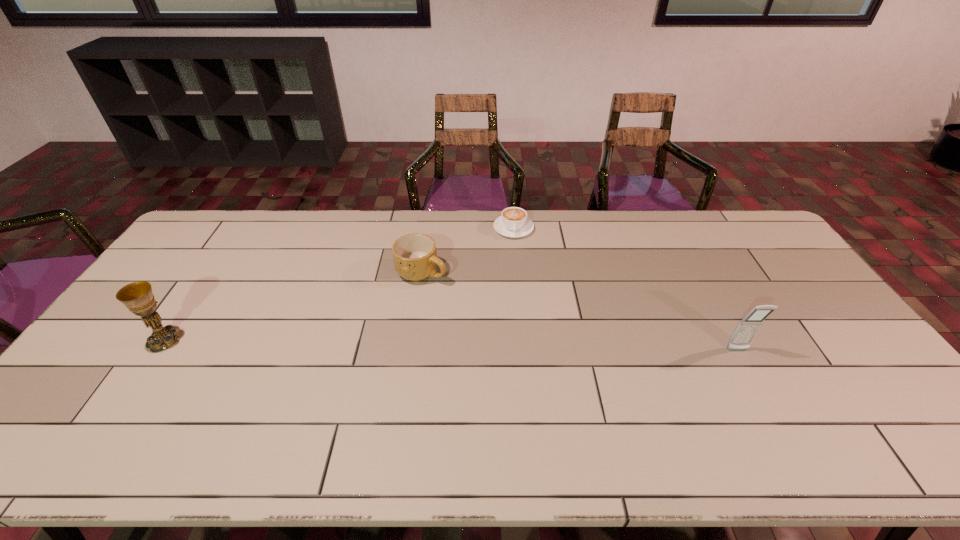
You are a GUI agent. You are given a task and a screenshot of the screen. Output one action in this format:
    pyautogui.click(x=<x>, y=<y>)
    Task: Click on the free space on the desktop that is between the leftmost object and the rightmost object and is positioned on the side with the handle of the third nearest object
    
    Given the screenshot: What is the action you would take?
    pyautogui.click(x=523, y=346)

In order to click on vacant space on the desktop that is between the chalice and the rightmost object and is positioned on the side of the third object from left to right with the handle in this screenshot , I will do `click(519, 346)`.